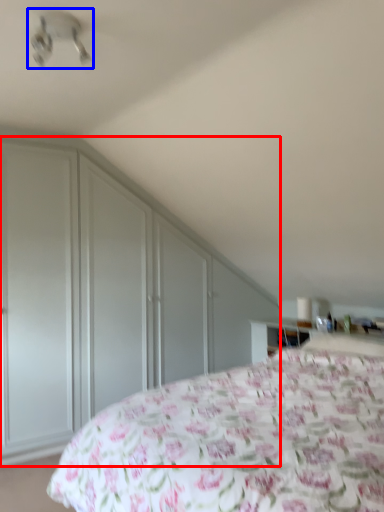
Question: Among these objects, which one is farthest to the camera, dresser (highlighted by a red box) or fan (highlighted by a blue box)?

Choices:
 (A) dresser
 (B) fan

Answer: (A)